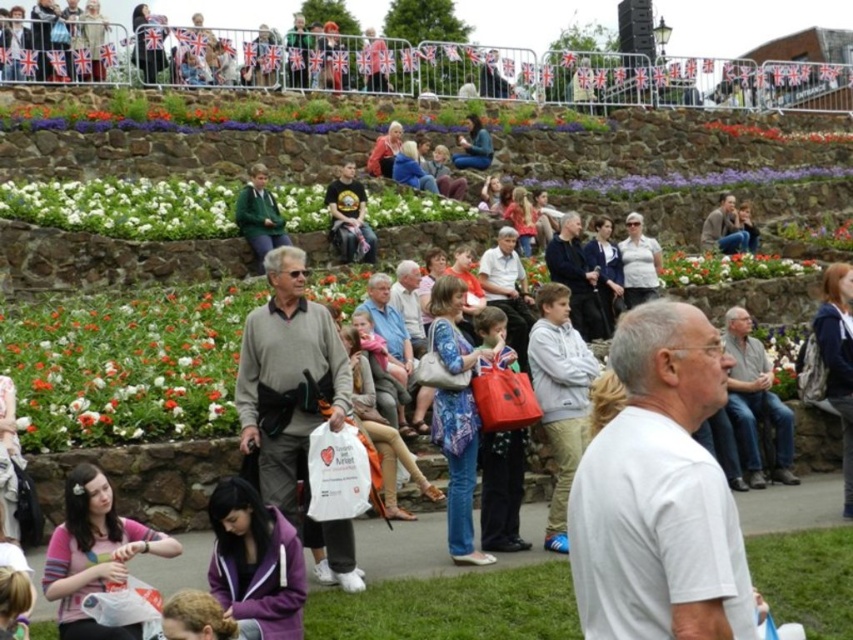
Measure the distance between white cotton shirt at center and green sweater at center.

A distance of 28.25 meters exists between white cotton shirt at center and green sweater at center.

Can you confirm if white cotton shirt at center is positioned below green sweater at center?

Yes, white cotton shirt at center is below green sweater at center.

Image resolution: width=853 pixels, height=640 pixels. I want to click on white cotton shirt at center, so point(659,493).

Is pink fabric shirt at lower left above floral fabric flower at center?

Actually, pink fabric shirt at lower left is below floral fabric flower at center.

Who is positioned more to the left, pink fabric shirt at lower left or floral fabric flower at center?

From the viewer's perspective, pink fabric shirt at lower left appears more on the left side.

Is point (115, 545) in front of point (724, 264)?

Yes, point (115, 545) is closer to viewer.

Locate an element on the screen. Image resolution: width=853 pixels, height=640 pixels. pink fabric shirt at lower left is located at coordinates (94, 554).

Is white cotton shirt at center shorter than matte black t-shirt at center?

Incorrect, white cotton shirt at center's height does not fall short of matte black t-shirt at center's.

Can you confirm if white cotton shirt at center is wider than matte black t-shirt at center?

Indeed, white cotton shirt at center has a greater width compared to matte black t-shirt at center.

Is point (700, 344) less distant than point (334, 221)?

Yes.

Where is `white cotton shirt at center`? white cotton shirt at center is located at coordinates (659, 493).